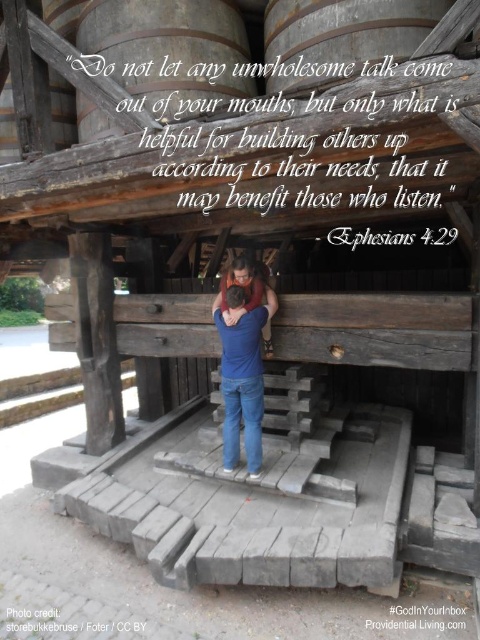
Is wooden barrel at center to the left of smooth wooden barrel at upper left from the viewer's perspective?

In fact, wooden barrel at center is to the right of smooth wooden barrel at upper left.

Which is above, wooden barrel at center or smooth wooden barrel at upper left?

smooth wooden barrel at upper left

Where is `wooden barrel at center`? The image size is (480, 640). wooden barrel at center is located at coordinates (170, 51).

The image size is (480, 640). Describe the element at coordinates (62, 109) in the screenshot. I see `smooth wooden barrel at upper left` at that location.

The width and height of the screenshot is (480, 640). What are the coordinates of `smooth wooden barrel at upper left` in the screenshot? It's located at (62, 109).

Can you confirm if smooth wooden barrel at upper center is positioned above blue denim jeans at center?

Correct, smooth wooden barrel at upper center is located above blue denim jeans at center.

In the scene shown: Can you confirm if smooth wooden barrel at upper center is taller than blue denim jeans at center?

Incorrect, smooth wooden barrel at upper center's height is not larger of blue denim jeans at center's.

Between point (380, 28) and point (240, 268), which one is positioned in front?

Positioned in front is point (380, 28).

Locate an element on the screen. The image size is (480, 640). smooth wooden barrel at upper center is located at coordinates (340, 36).